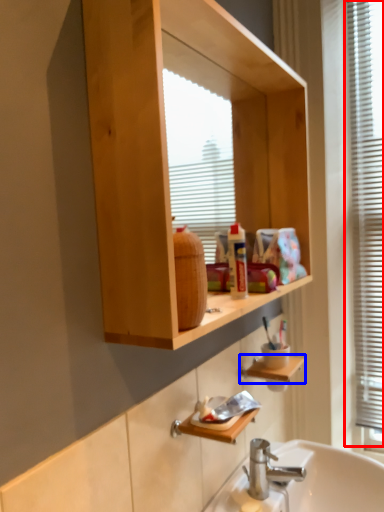
Question: Which point is closer to the camera, window frame (highlighted by a red box) or cabinet (highlighted by a blue box)?

Choices:
 (A) window frame
 (B) cabinet

Answer: (B)